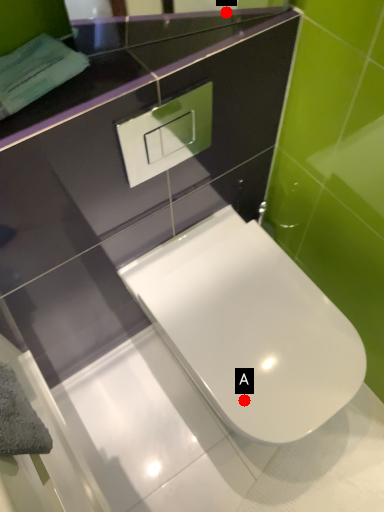
Question: Two points are circled on the image, labeled by A and B beside each circle. Which point is closer to the camera?

Choices:
 (A) A is closer
 (B) B is closer

Answer: (B)